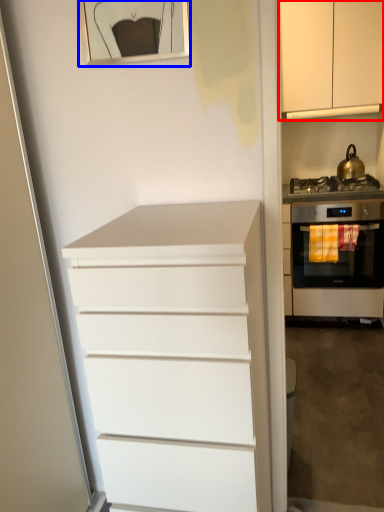
Question: Among these objects, which one is nearest to the camera, cabinetry (highlighted by a red box) or picture frame (highlighted by a blue box)?

Choices:
 (A) cabinetry
 (B) picture frame

Answer: (B)